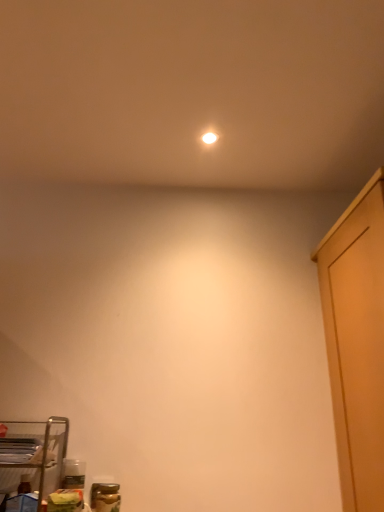
Question: Can you confirm if white glossy light bulb at upper center is smaller than metal wire rack at lower left?

Choices:
 (A) yes
 (B) no

Answer: (A)

Question: Considering the relative positions of white glossy light bulb at upper center and metal wire rack at lower left in the image provided, is white glossy light bulb at upper center to the right of metal wire rack at lower left from the viewer's perspective?

Choices:
 (A) no
 (B) yes

Answer: (B)

Question: Is white glossy light bulb at upper center further to the viewer compared to metal wire rack at lower left?

Choices:
 (A) yes
 (B) no

Answer: (A)

Question: Can you confirm if white glossy light bulb at upper center is shorter than metal wire rack at lower left?

Choices:
 (A) yes
 (B) no

Answer: (A)

Question: Does white glossy light bulb at upper center have a lesser width compared to metal wire rack at lower left?

Choices:
 (A) no
 (B) yes

Answer: (B)

Question: From a real-world perspective, is white glossy light bulb at upper center below metal wire rack at lower left?

Choices:
 (A) yes
 (B) no

Answer: (B)

Question: Can you confirm if metal wire rack at lower left is wider than white glossy light bulb at upper center?

Choices:
 (A) yes
 (B) no

Answer: (A)

Question: Does metal wire rack at lower left have a lesser width compared to white glossy light bulb at upper center?

Choices:
 (A) no
 (B) yes

Answer: (A)

Question: From the image's perspective, would you say metal wire rack at lower left is shown under white glossy light bulb at upper center?

Choices:
 (A) yes
 (B) no

Answer: (A)

Question: Would you consider metal wire rack at lower left to be distant from white glossy light bulb at upper center?

Choices:
 (A) no
 (B) yes

Answer: (B)

Question: Can you confirm if metal wire rack at lower left is positioned to the left of white glossy light bulb at upper center?

Choices:
 (A) no
 (B) yes

Answer: (B)

Question: Is metal wire rack at lower left outside of white glossy light bulb at upper center?

Choices:
 (A) no
 (B) yes

Answer: (B)

Question: From their relative heights in the image, would you say white glossy light bulb at upper center is taller or shorter than metal wire rack at lower left?

Choices:
 (A) short
 (B) tall

Answer: (A)